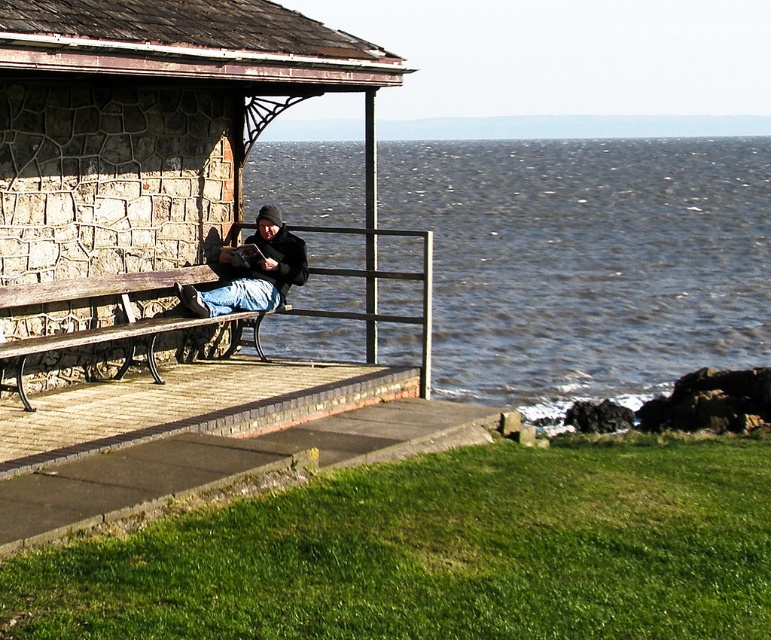
Who is more distant from viewer, (577, 147) or (187, 268)?

The point (577, 147) is behind.

Consider the image. Which is more to the left, dark blue water at center or wooden bench at left?

wooden bench at left is more to the left.

Does point (719, 352) lie in front of point (76, 278)?

No, (719, 352) is further to viewer.

I want to click on dark blue water at center, so click(x=586, y=262).

Between stone textured bench at left and jeans at center, which one appears on the right side from the viewer's perspective?

Positioned to the right is jeans at center.

In the scene shown: Between stone textured bench at left and jeans at center, which one is positioned lower?

jeans at center

Who is more forward, (174,168) or (270,260)?

Positioned in front is point (174,168).

Where is `stone textured bench at left`? The image size is (771, 640). stone textured bench at left is located at coordinates (150, 124).

Does dark blue water at center come in front of jeans at center?

No, it is behind jeans at center.

Which of these two, dark blue water at center or jeans at center, stands taller?

With more height is dark blue water at center.

Image resolution: width=771 pixels, height=640 pixels. I want to click on dark blue water at center, so click(x=586, y=262).